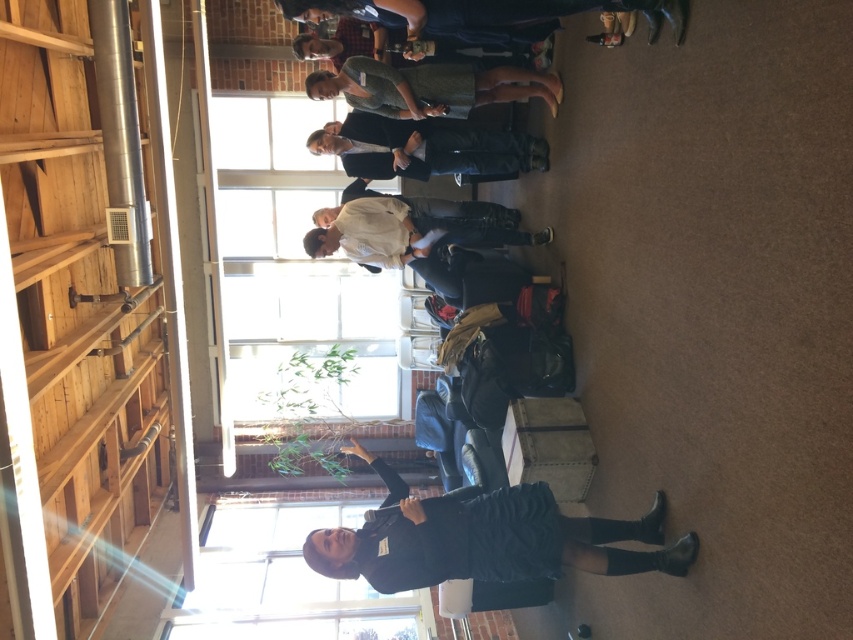
Is white cotton shirt at center closer to camera compared to green textured dress at upper center?

No, it is not.

Does point (316, 234) come closer to viewer compared to point (534, 72)?

No.

Does point (412, 225) come farther from viewer compared to point (437, 70)?

Yes, it is behind point (437, 70).

The height and width of the screenshot is (640, 853). I want to click on white cotton shirt at center, so click(x=413, y=225).

In the scene shown: Can you confirm if black textured dress at center is positioned above green textured dress at upper center?

No, black textured dress at center is not above green textured dress at upper center.

Which is behind, point (627, 532) or point (329, 93)?

Positioned behind is point (329, 93).

Does point (386, 554) lie in front of point (534, 93)?

That is True.

Locate an element on the screen. The width and height of the screenshot is (853, 640). black textured dress at center is located at coordinates (488, 538).

Is point (654, 520) positioned behind point (410, 177)?

No, it is in front of (410, 177).

Where is `black textured dress at center`? black textured dress at center is located at coordinates (488, 538).